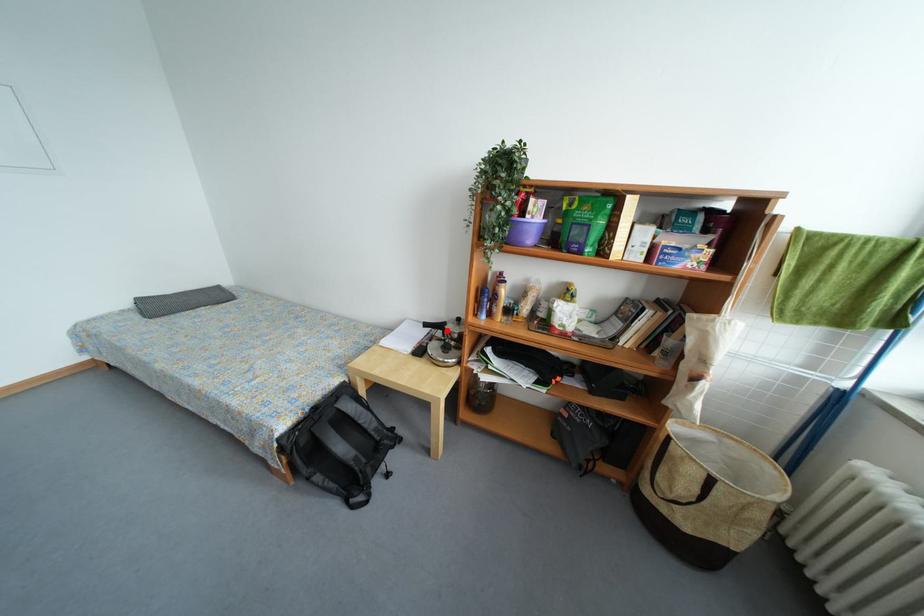
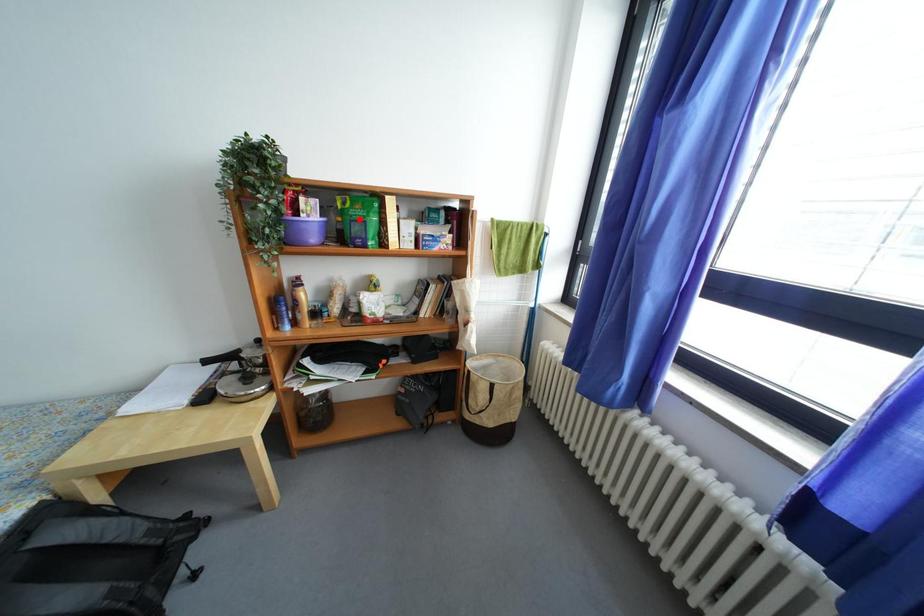
I am providing you with two images of the same scene from different viewpoints. A red point is marked on the first image and another point is marked on the second image. Does the point marked in image1 correspond to the same location as the one in image2?

No